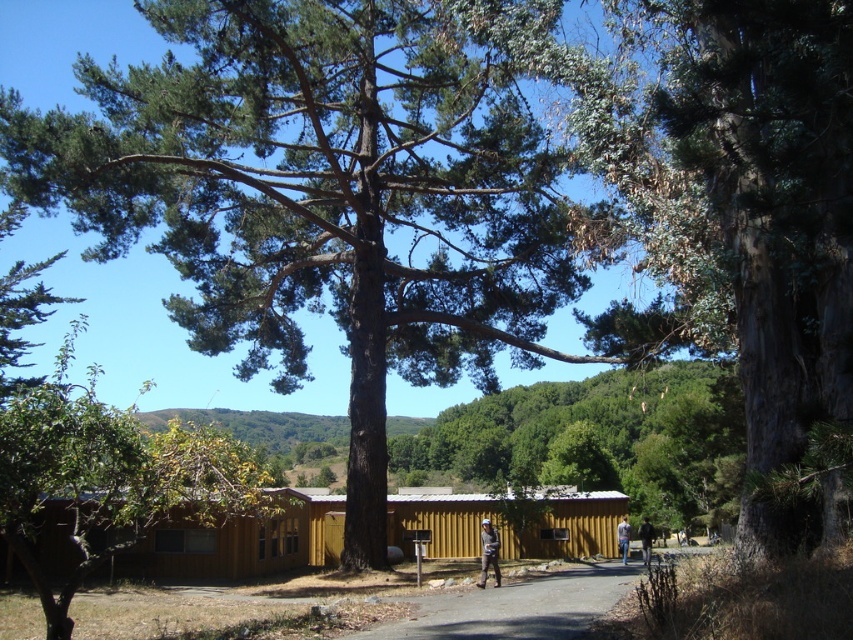
Question: Does gray asphalt path at center appear on the left side of brown leather jacket at center?

Choices:
 (A) no
 (B) yes

Answer: (A)

Question: Does wooden cabin at center appear over gray asphalt path at center?

Choices:
 (A) yes
 (B) no

Answer: (B)

Question: Where is gray asphalt path at center located in relation to brown leather jacket at center in the image?

Choices:
 (A) above
 (B) below

Answer: (B)

Question: Which object appears closest to the camera in this image?

Choices:
 (A) wooden cabin at center
 (B) gray asphalt path at center
 (C) green leafy tree at center
 (D) brown wood cabin at lower left

Answer: (D)

Question: Which point is closer to the camera taking this photo?

Choices:
 (A) (573, 454)
 (B) (519, 556)

Answer: (B)

Question: Which object is closer to the camera taking this photo?

Choices:
 (A) dark blue jeans at lower right
 (B) green leafy tree at center
 (C) gray asphalt path at center

Answer: (C)